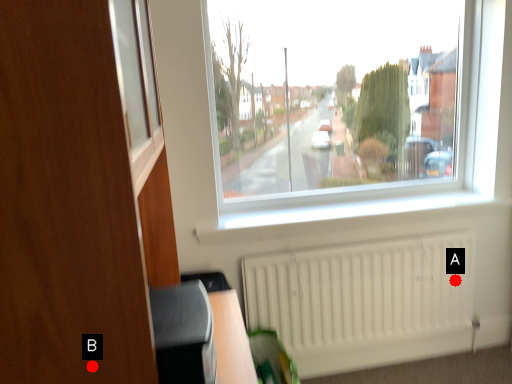
Question: Two points are circled on the image, labeled by A and B beside each circle. Which point appears farthest from the camera in this image?

Choices:
 (A) A is further
 (B) B is further

Answer: (A)